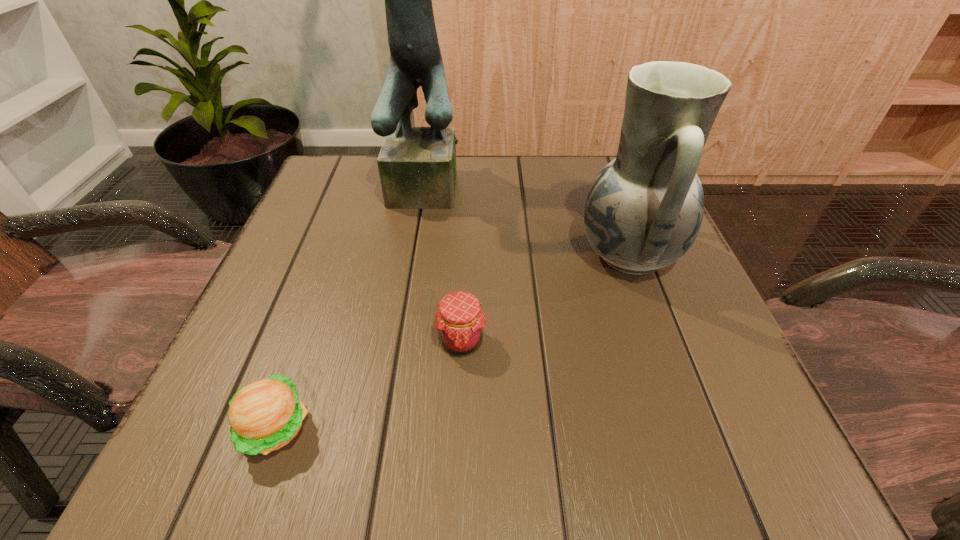
You are a GUI agent. You are given a task and a screenshot of the screen. Output one action in this format:
    pyautogui.click(x=<x>, y=<y>)
    Task: Click on the free space located on the front-facing side of the second farthest object
    The image size is (960, 540).
    Given the screenshot: What is the action you would take?
    pyautogui.click(x=403, y=254)

Where is `vacant space located on the right of the second nearest object`? The height and width of the screenshot is (540, 960). vacant space located on the right of the second nearest object is located at coordinates (595, 341).

The height and width of the screenshot is (540, 960). I want to click on free spot located 0.070m on the right of the hamburger, so click(367, 427).

At what (x,y) coordinates should I click in order to perform the action: click on object positioned at the far edge. Please return your answer as a coordinate pair (x, y). Looking at the image, I should click on (417, 167).

Find the location of `object present at the near edge`. object present at the near edge is located at coordinates (264, 416).

This screenshot has height=540, width=960. I want to click on object situated at the left edge, so click(264, 416).

Where is `object at the right edge`? This screenshot has width=960, height=540. object at the right edge is located at coordinates (644, 210).

At what (x,y) coordinates should I click in order to perform the action: click on object at the near left corner. Please return your answer as a coordinate pair (x, y). Looking at the image, I should click on (264, 416).

Locate an element on the screen. vacant area at the far edge of the desktop is located at coordinates (x=512, y=207).

Where is `vacant position at the near edge of the desktop`? The height and width of the screenshot is (540, 960). vacant position at the near edge of the desktop is located at coordinates (439, 453).